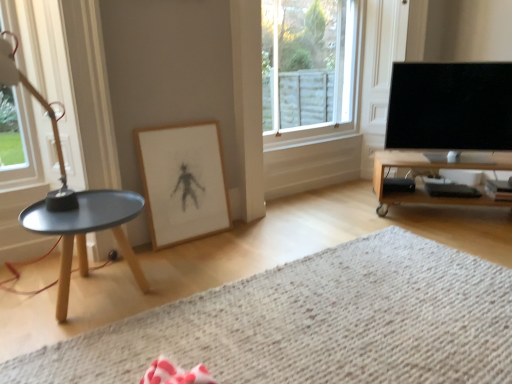
Question: From the image's perspective, does wooden framed drawing at center appear higher than clear glass window at upper center, marked as the 2th window in a front-to-back arrangement?

Choices:
 (A) no
 (B) yes

Answer: (A)

Question: Is wooden framed drawing at center not inside clear glass window at upper center, positioned as the 2th window in left-to-right order?

Choices:
 (A) yes
 (B) no

Answer: (A)

Question: Considering the relative sizes of wooden framed drawing at center and clear glass window at upper center, positioned as the 2th window in left-to-right order, in the image provided, is wooden framed drawing at center shorter than clear glass window at upper center, positioned as the 2th window in left-to-right order,?

Choices:
 (A) yes
 (B) no

Answer: (A)

Question: Can you confirm if wooden framed drawing at center is wider than clear glass window at upper center, the first window viewed from the back?

Choices:
 (A) yes
 (B) no

Answer: (B)

Question: Is clear glass window at upper center, which is counted as the first window, starting from the right, inside wooden framed drawing at center?

Choices:
 (A) yes
 (B) no

Answer: (B)

Question: Considering the relative sizes of wooden framed drawing at center and clear glass window at upper center, which is counted as the first window, starting from the right, in the image provided, is wooden framed drawing at center taller than clear glass window at upper center, which is counted as the first window, starting from the right,?

Choices:
 (A) yes
 (B) no

Answer: (B)

Question: Is wooden framed drawing at center aimed at white textured rug at lower center?

Choices:
 (A) yes
 (B) no

Answer: (A)

Question: From a real-world perspective, is wooden framed drawing at center below white textured rug at lower center?

Choices:
 (A) yes
 (B) no

Answer: (B)

Question: From a real-world perspective, is wooden framed drawing at center on white textured rug at lower center?

Choices:
 (A) no
 (B) yes

Answer: (B)

Question: Is wooden framed drawing at center shorter than white textured rug at lower center?

Choices:
 (A) no
 (B) yes

Answer: (A)

Question: Considering the relative sizes of wooden framed drawing at center and white textured rug at lower center in the image provided, is wooden framed drawing at center smaller than white textured rug at lower center?

Choices:
 (A) no
 (B) yes

Answer: (B)

Question: Does wooden framed drawing at center contain white textured rug at lower center?

Choices:
 (A) yes
 (B) no

Answer: (B)

Question: Is black glossy tv at right thinner than clear glass window at upper center, positioned as the 2th window in left-to-right order?

Choices:
 (A) yes
 (B) no

Answer: (B)